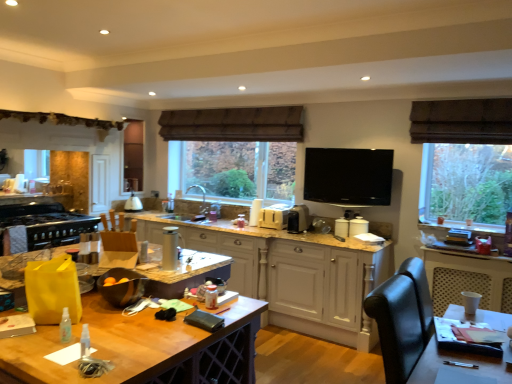
Image resolution: width=512 pixels, height=384 pixels. I want to click on free space to the left of satin silver toaster at center, marked as the second appliance in a right-to-left arrangement, so click(277, 230).